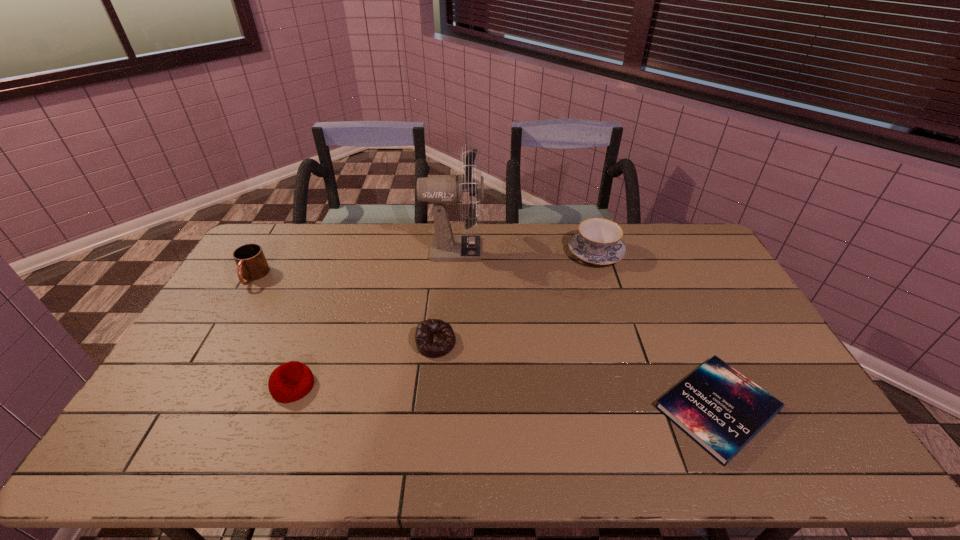
Find the location of a particular element. This screenshot has height=540, width=960. vacant space located 0.070m with the handle on the side of the chinaware is located at coordinates [x=588, y=225].

This screenshot has height=540, width=960. I want to click on vacant region located 0.180m on the side of the mug with the handle, so click(x=222, y=330).

At what (x,y) coordinates should I click in order to perform the action: click on free space located 0.390m on the seat area of the second object from left to right. Please return your answer as a coordinate pair (x, y). The width and height of the screenshot is (960, 540). Looking at the image, I should click on (458, 386).

Locate an element on the screen. vacant space located 0.100m on the back of the shorter beanbag is located at coordinates (440, 305).

The image size is (960, 540). Identify the location of free region located 0.230m on the back of the hardback book. (670, 304).

Where is `fan that is at the far edge`? fan that is at the far edge is located at coordinates (445, 246).

The image size is (960, 540). In order to click on chinaware positioned at the far edge in this screenshot , I will do `click(598, 241)`.

Locate an element on the screen. The image size is (960, 540). object that is at the near edge is located at coordinates pos(718,407).

You are a GUI agent. You are given a task and a screenshot of the screen. Output one action in this format:
    pyautogui.click(x=<x>, y=<y>)
    Task: Click on the object positioned at the left edge
    This screenshot has width=960, height=540.
    Given the screenshot: What is the action you would take?
    pyautogui.click(x=252, y=265)

At what (x,y) coordinates should I click in order to perform the action: click on object located at the right edge. Please return your answer as a coordinate pair (x, y). The height and width of the screenshot is (540, 960). Looking at the image, I should click on (718, 407).